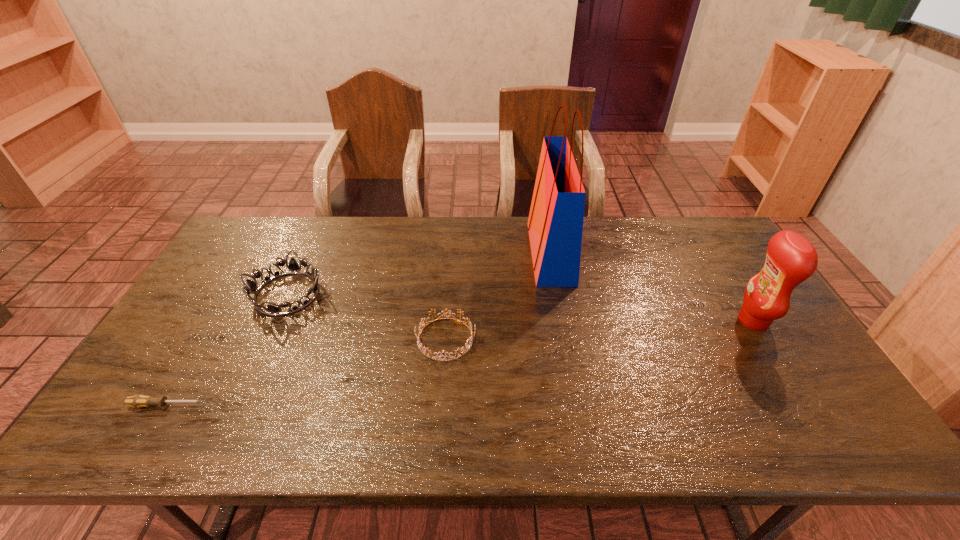
At what (x,y) coordinates should I click in order to perform the action: click on vacant space located 0.250m on the handle side of the second object from right to left. Please return your answer as a coordinate pair (x, y). Looking at the image, I should click on (455, 253).

The width and height of the screenshot is (960, 540). Find the location of `vacant space located 0.220m on the handle side of the second object from right to left`. vacant space located 0.220m on the handle side of the second object from right to left is located at coordinates (464, 253).

In order to click on vacant space located 0.200m on the handle side of the second object from right to left in this screenshot , I will do `click(469, 253)`.

The image size is (960, 540). I want to click on vacant region located on the label side of the fourth shortest object, so click(666, 321).

The width and height of the screenshot is (960, 540). I want to click on vacant area situated on the label side of the fourth shortest object, so click(x=616, y=321).

Identify the location of vacant space located on the label side of the fourth shortest object. This screenshot has width=960, height=540. (673, 321).

The image size is (960, 540). I want to click on free space located 0.070m on the front-facing side of the left tiara, so click(x=265, y=342).

Image resolution: width=960 pixels, height=540 pixels. I want to click on vacant region located on the front-facing side of the shorter tiara, so click(x=502, y=339).

This screenshot has width=960, height=540. What are the coordinates of `free region located at the tip of the nearest object` in the screenshot? It's located at (357, 405).

Where is `object that is at the far edge`? This screenshot has height=540, width=960. object that is at the far edge is located at coordinates (555, 224).